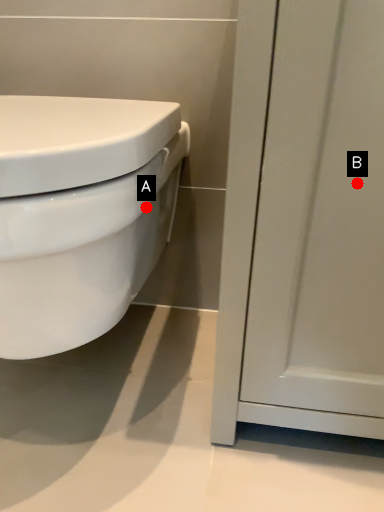
Question: Two points are circled on the image, labeled by A and B beside each circle. Which point is closer to the camera taking this photo?

Choices:
 (A) A is closer
 (B) B is closer

Answer: (B)